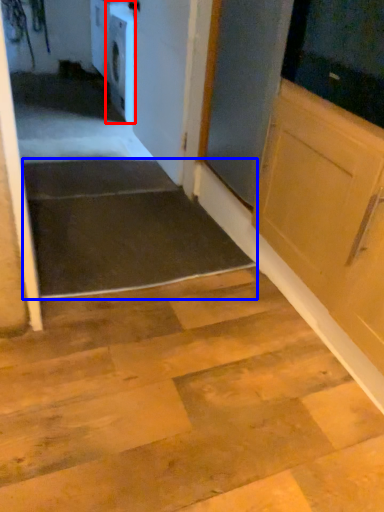
Question: Among these objects, which one is farthest to the camera, dish washer (highlighted by a red box) or stairwell (highlighted by a blue box)?

Choices:
 (A) dish washer
 (B) stairwell

Answer: (A)